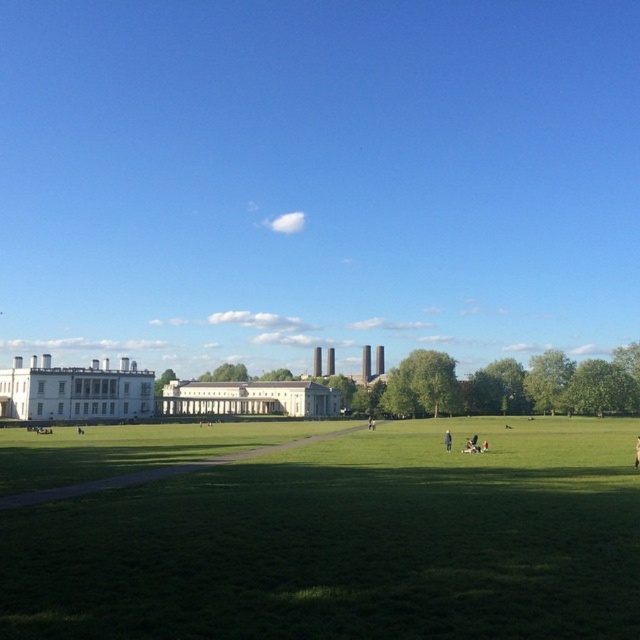
Looking at this image, you are standing on the green grass at center and want to look up at the blue sky at upper center. In which direction should you move your gaze?

You should look upward because the blue sky at upper center is located above the green grass at center.

You are a photographer planning to capture a wide shot of the green grass at center and dark blue fabric at center in the field. The camera you are using has a maximum focus range of 20 meters. Will you be able to capture both objects in focus at the same time?

The green grass at center and dark blue fabric at center are 21.63 meters apart from each other. Since the camera can only focus up to 20 meters, it won not be able to capture both objects in focus simultaneously.

You are a gardener who needs to mow the lawn. You see the green grass at center and the dark blue fabric at center. Which area should you mow first based on their heights?

The green grass at center is taller than the dark blue fabric at center, so you should mow the green grass at center first.